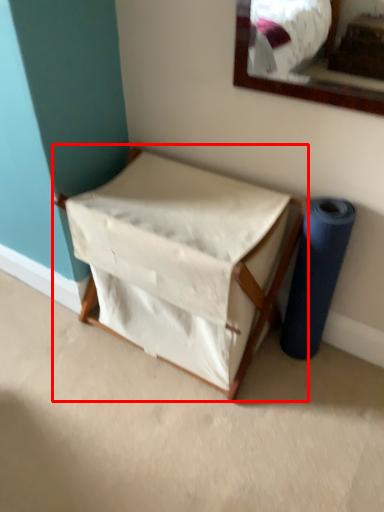
Question: In this image, where is furniture (annotated by the red box) located relative to duct tape?

Choices:
 (A) right
 (B) left

Answer: (B)